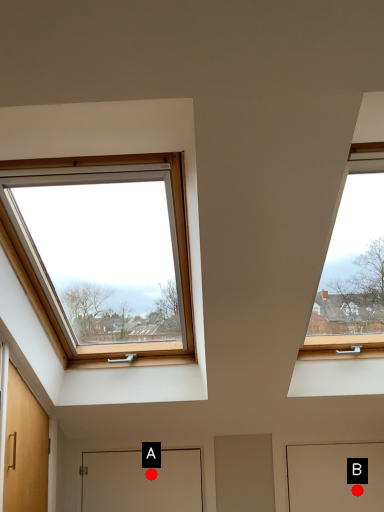
Question: Two points are circled on the image, labeled by A and B beside each circle. Which point appears closest to the camera in this image?

Choices:
 (A) A is closer
 (B) B is closer

Answer: (B)